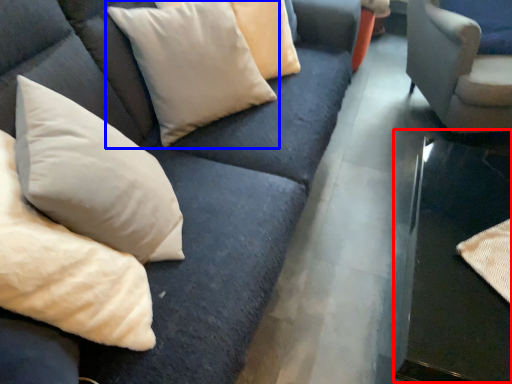
Question: Among these objects, which one is farthest to the camera, table (highlighted by a red box) or pillow (highlighted by a blue box)?

Choices:
 (A) table
 (B) pillow

Answer: (B)